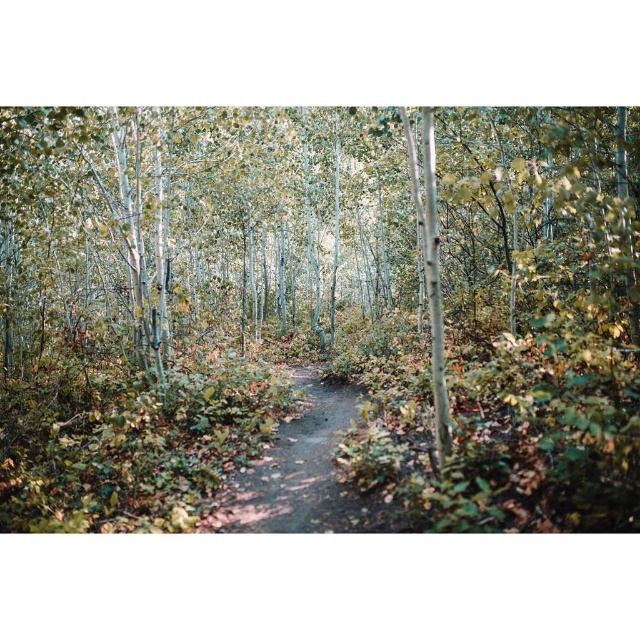
From the picture: You are a hiker who wants to follow the path through the forest. You notice two paths in front of you, the green matte path at center and the dirt path at center. Which path is higher in elevation?

The green matte path at center is taller than the dirt path at center, so the green matte path at center is higher in elevation.

You are a hiker with a 3 meter long rope. You want to measure the distance from your current position to the green matte path at center. Can you determine if your rope is long enough to reach the path?

The green matte path at center is 2.97 meters away from the camera, so yes, the rope is long enough to reach the path since it is slightly shorter than the rope.